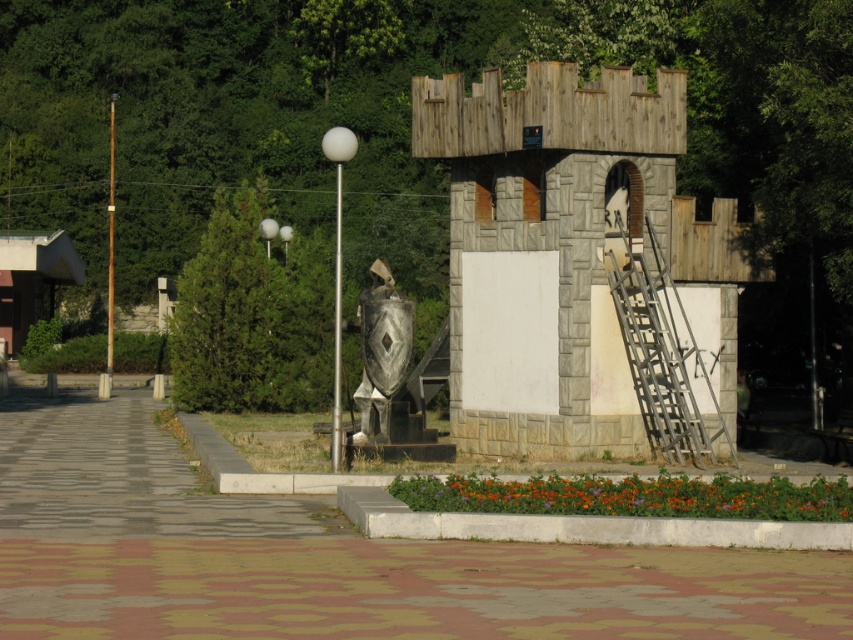
Between point (643, 401) and point (410, 300), which one is positioned behind?

The point (643, 401) is more distant.

Is point (688, 429) positioned in front of point (395, 355)?

No, it is not.

Which is behind, point (624, 241) or point (367, 428)?

The point (624, 241) is behind.

This screenshot has height=640, width=853. Find the location of `metallic silver ladder at right`. metallic silver ladder at right is located at coordinates (664, 356).